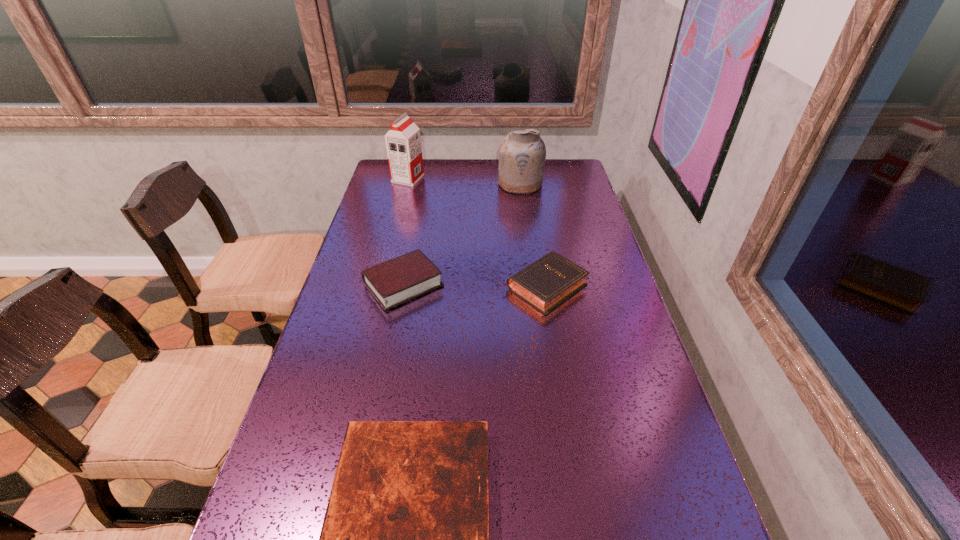
I want to click on soya milk, so click(x=403, y=141).

Where is `pottery`? Image resolution: width=960 pixels, height=540 pixels. pottery is located at coordinates (522, 154).

This screenshot has height=540, width=960. In order to click on the rightmost Bible in this screenshot , I will do `click(545, 284)`.

Identify the location of vacant space located 0.210m on the front of the soya milk. (398, 215).

This screenshot has height=540, width=960. In order to click on vacant region located on the left of the pottery in this screenshot , I will do pyautogui.click(x=448, y=183).

The image size is (960, 540). In order to click on vacant space located on the front of the rightmost Bible in this screenshot , I will do `click(560, 372)`.

The width and height of the screenshot is (960, 540). Identify the location of soya milk at the far edge. (403, 141).

Where is `pottery present at the far edge`? The height and width of the screenshot is (540, 960). pottery present at the far edge is located at coordinates (522, 154).

At what (x,y) coordinates should I click in order to perform the action: click on soya milk at the left edge. Please return your answer as a coordinate pair (x, y). Looking at the image, I should click on (403, 141).

Where is `Bible located in the left edge section of the desktop`? Bible located in the left edge section of the desktop is located at coordinates (396, 281).